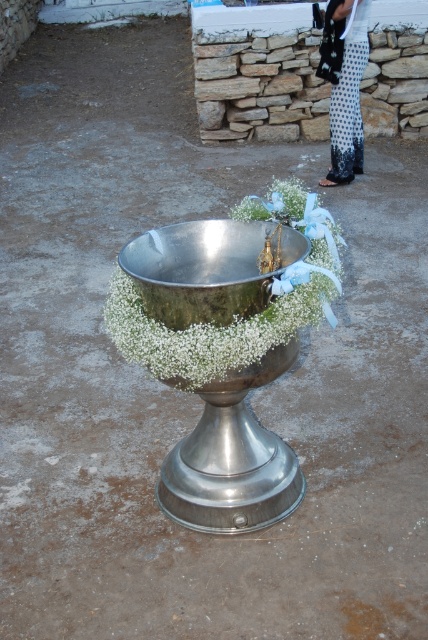
You are standing at the baptismal font and looking at two points marked on the concrete surface. The first point is at coordinate point [308,266] and the second is at point [192,256]. Which point is closer to you?

Point [308,266] is in front of point [192,256], so it is closer to you.

You are a photographer setting up for a photoshoot. You have a metallic silver bowl at center and polka dot fabric pants at right. Which object is wider?

The metallic silver bowl at center is wider than the polka dot fabric pants at right.

You are standing in front of the baptismal font and want to place a small decoration. You have two points marked on the font where you can place it. Which point is closer to you, point (330, 298) or point (362, 164)?

Point (330, 298) is closer to the camera than point (362, 164), so you should place the decoration there if you want it closer to you.